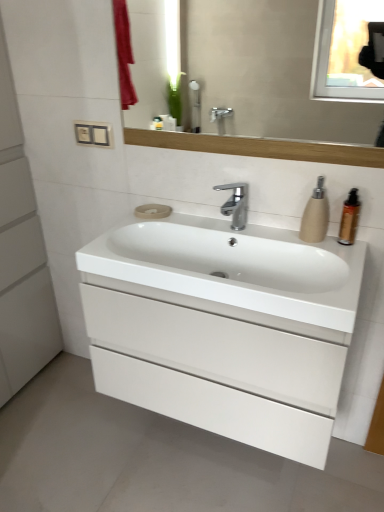
Where is `vacant region above white glossy cabinet at center (from a real-world perspective)`? The image size is (384, 512). vacant region above white glossy cabinet at center (from a real-world perspective) is located at coordinates (218, 259).